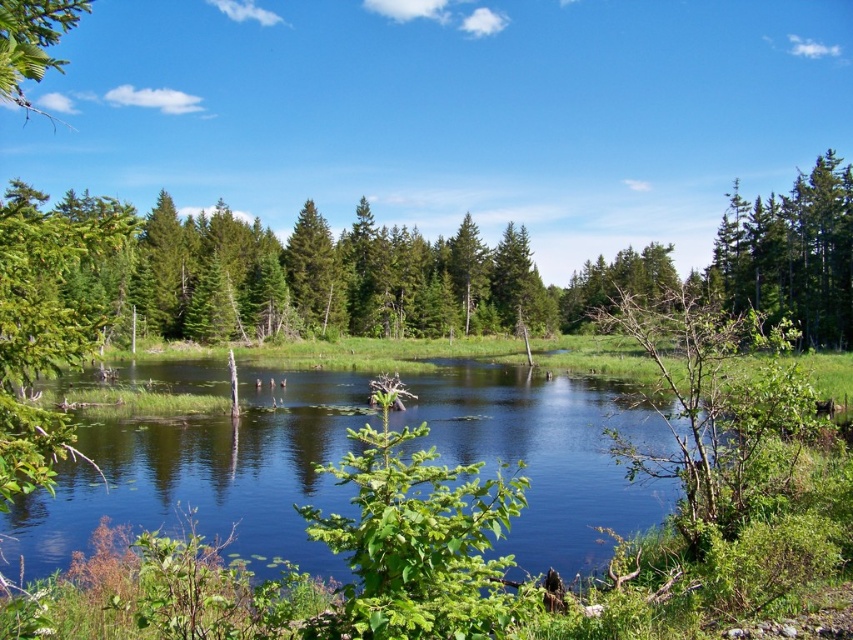
Question: Estimate the real-world distances between objects in this image. Which object is farther from the clear water at center?

Choices:
 (A) green matte tree at upper right
 (B) green matte tree at center

Answer: (A)

Question: Among these points, which one is nearest to the camera?

Choices:
 (A) (328, 276)
 (B) (636, 497)
 (C) (833, 339)

Answer: (B)

Question: Considering the relative positions of clear water at center and green matte tree at center in the image provided, where is clear water at center located with respect to green matte tree at center?

Choices:
 (A) left
 (B) right

Answer: (B)

Question: Is green matte tree at upper right smaller than green matte tree at center?

Choices:
 (A) yes
 (B) no

Answer: (B)

Question: Among these objects, which one is nearest to the camera?

Choices:
 (A) green matte tree at center
 (B) clear water at center

Answer: (B)

Question: Can you confirm if clear water at center is positioned above green matte tree at center?

Choices:
 (A) yes
 (B) no

Answer: (B)